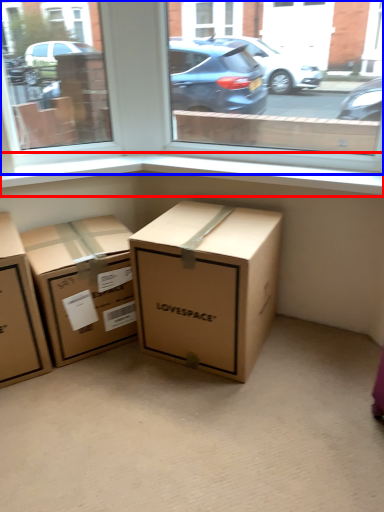
Question: Among these objects, which one is nearest to the camera, window sill (highlighted by a red box) or window (highlighted by a blue box)?

Choices:
 (A) window sill
 (B) window

Answer: (B)